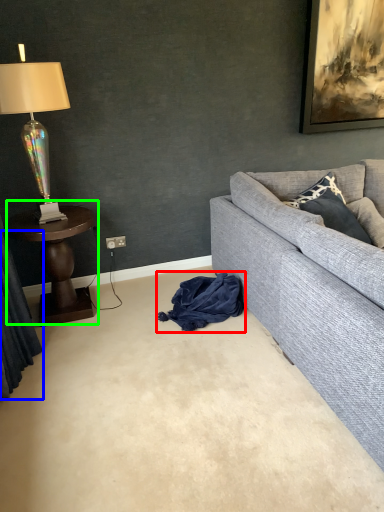
Question: Considering the real-world distances, which object is farthest from material (highlighted by a red box)? curtain (highlighted by a blue box) or table (highlighted by a green box)?

Choices:
 (A) curtain
 (B) table

Answer: (A)